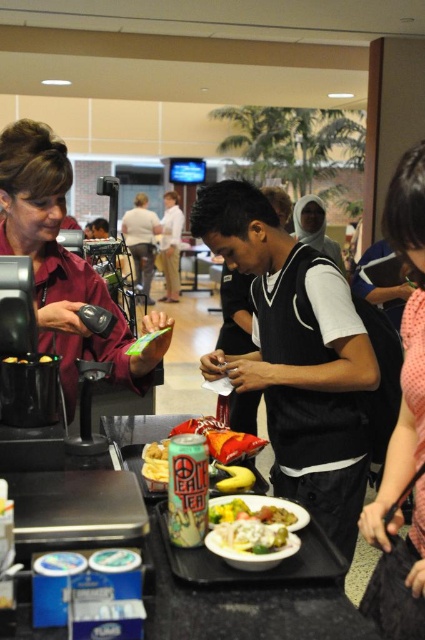
Question: Observing the image, what is the correct spatial positioning of pink dotted dress at right in reference to yellow matte banana at center?

Choices:
 (A) below
 (B) above

Answer: (B)

Question: Can you confirm if yellow matte banana at center is smaller than yellow matte chips at center?

Choices:
 (A) no
 (B) yes

Answer: (A)

Question: Which object is positioned closest to the yellow matte chips at center?

Choices:
 (A) shiny white plate at center
 (B) yellow matte banana at center
 (C) pink dotted dress at right
 (D) matte maroon shirt at left

Answer: (D)

Question: Observing the image, what is the correct spatial positioning of matte maroon shirt at left in reference to yellow matte chips at center?

Choices:
 (A) right
 (B) left

Answer: (B)

Question: Based on their relative distances, which object is nearer to the pink dotted dress at right?

Choices:
 (A) matte maroon shirt at left
 (B) yellow matte chips at center
 (C) shiny white plate at center
 (D) yellow matte banana at center

Answer: (C)

Question: Among these objects, which one is nearest to the camera?

Choices:
 (A) matte maroon shirt at left
 (B) shiny white plate at center

Answer: (B)